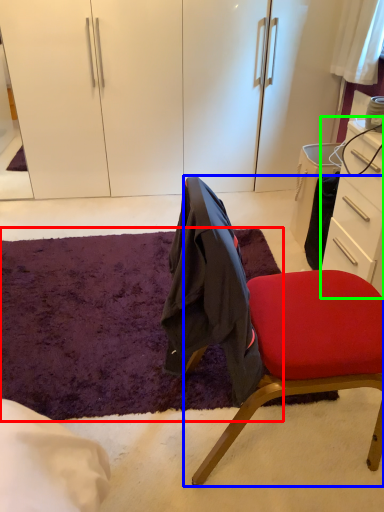
Question: Which object is positioned closest to mat (highlighted by a red box)? Select from chair (highlighted by a blue box) and desk (highlighted by a green box).

Choices:
 (A) chair
 (B) desk

Answer: (A)